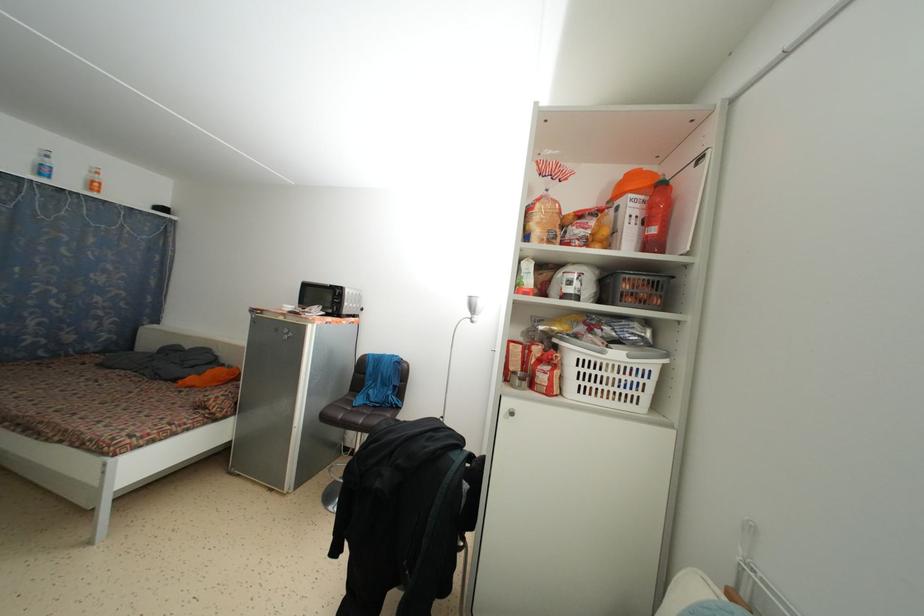
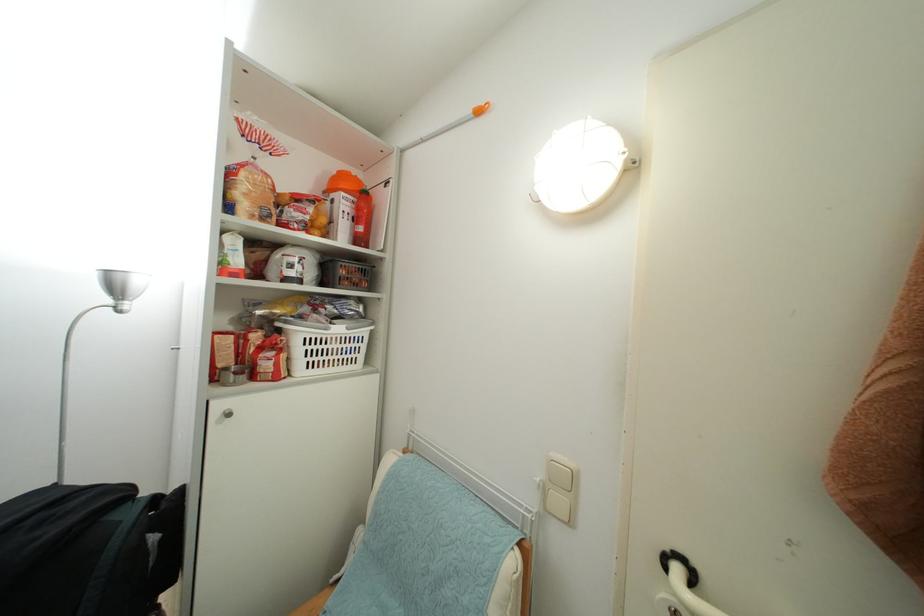
In the second image, find the point that corresponds to point 542,229 in the first image.

(249, 200)